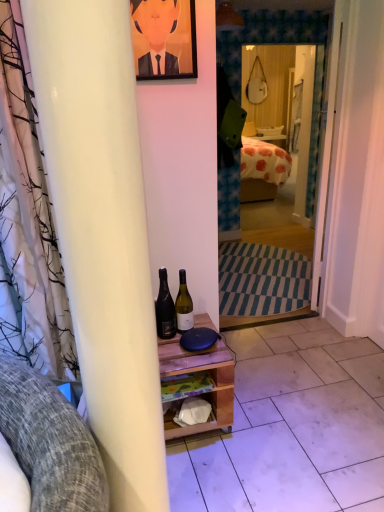
Question: Is black glass bottle at center, which ranks as the second bottle in right-to-left order, inside the boundaries of matte white mirror at center, or outside?

Choices:
 (A) outside
 (B) inside

Answer: (A)

Question: Considering the positions of black glass bottle at center, which ranks as the second bottle in right-to-left order, and matte white mirror at center in the image, is black glass bottle at center, which ranks as the second bottle in right-to-left order, bigger or smaller than matte white mirror at center?

Choices:
 (A) big
 (B) small

Answer: (B)

Question: Estimate the real-world distances between objects in this image. Which object is farther from the black glass bottle at center, which ranks as the second bottle in right-to-left order?

Choices:
 (A) orange painted portrait at upper center
 (B) white matte bottle at center, the 2th bottle positioned from the left
 (C) white tile at lower right, positioned as the second tile in left-to-right order
 (D) white wooden door at center
 (E) wooden shelf at center, arranged as the second tile when viewed from the right

Answer: (D)

Question: Considering the real-world distances, which object is closest to the white tile at lower right, which is the first tile from right to left?

Choices:
 (A) matte white mirror at center
 (B) white wooden door at center
 (C) white matte bottle at center, the 2th bottle positioned from the left
 (D) orange painted portrait at upper center
 (E) wooden shelf at center, arranged as the second tile when viewed from the right

Answer: (E)